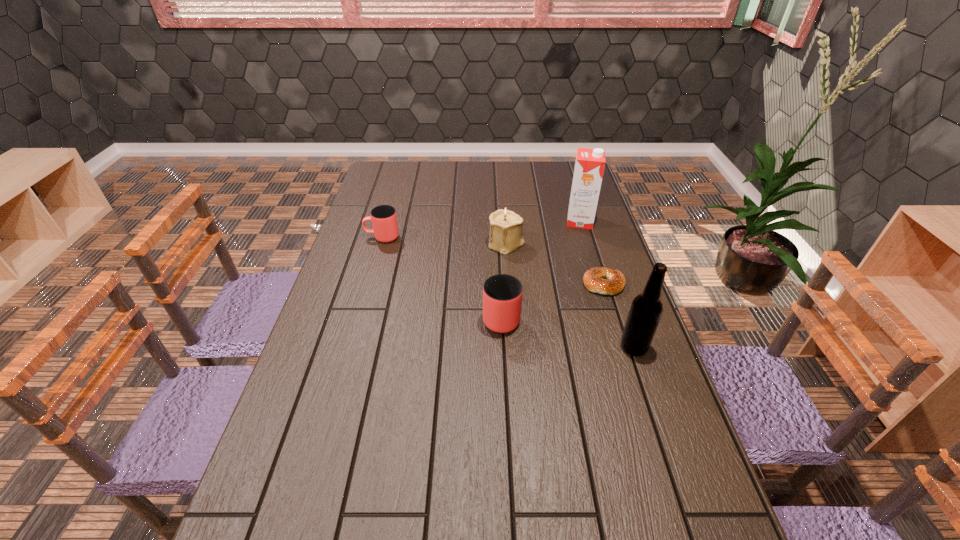
Find the location of a particular element. This screenshot has height=540, width=960. vacant area located 0.080m on the handle side of the second nearest object is located at coordinates (499, 280).

I want to click on vacant area situated 0.260m on the handle side of the second nearest object, so click(497, 245).

What are the coordinates of `free space located 0.210m on the left of the candle_holder` in the screenshot? It's located at (427, 244).

This screenshot has height=540, width=960. What are the coordinates of `free location located on the front of the carton` in the screenshot? It's located at (585, 238).

Locate an element on the screen. This screenshot has height=540, width=960. vacant space located on the front of the beer bottle is located at coordinates (678, 477).

Identify the location of vacant space situated 0.400m on the front of the shortest object. (646, 417).

The image size is (960, 540). Find the location of `object that is at the left edge`. object that is at the left edge is located at coordinates (384, 220).

The width and height of the screenshot is (960, 540). What are the coordinates of `carton at the right edge` in the screenshot? It's located at coord(589,166).

You are a GUI agent. You are given a task and a screenshot of the screen. Output one action in this format:
    pyautogui.click(x=<x>, y=<y>)
    Task: Click on the beer bottle located in the right edge section of the desktop
    The height and width of the screenshot is (540, 960).
    Given the screenshot: What is the action you would take?
    pyautogui.click(x=646, y=309)

Locate an element on the screen. This screenshot has height=540, width=960. bagel at the right edge is located at coordinates (593, 280).